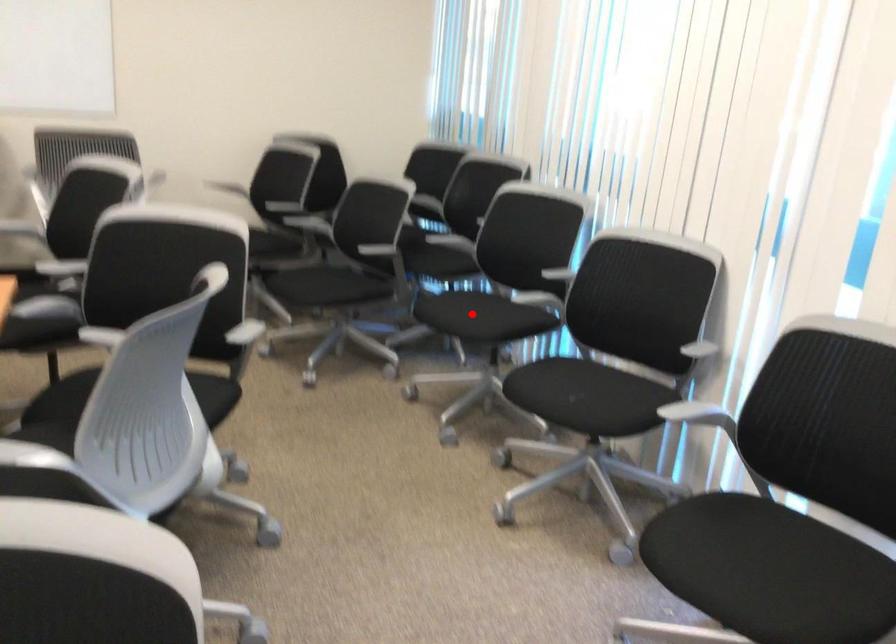
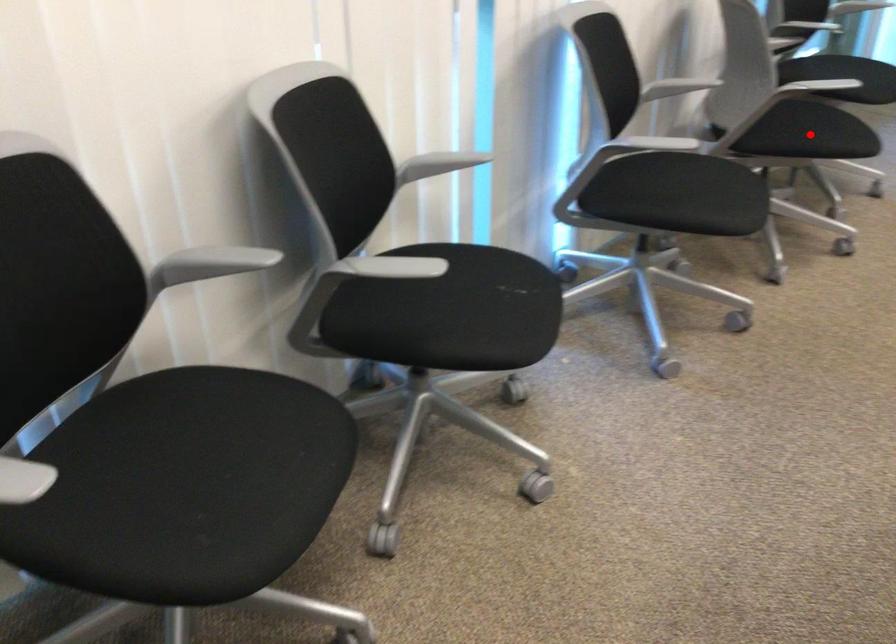
Looking at this image, I am providing you with two images of the same scene from different viewpoints. A red point is marked on the first image and another point is marked on the second image. Is the red point in image1 aligned with the point shown in image2?

No